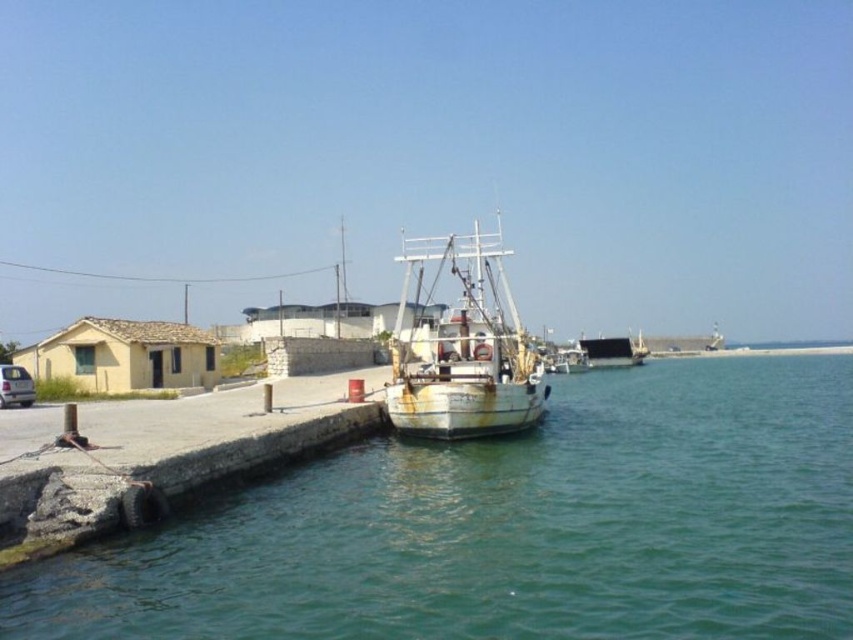
From the picture: You are a photographer wanting to capture the rusty metal boat at center and the green water at center in a single frame. Given that your camera has a fixed focal length, which object should you position closer to the center of the frame to ensure both fit within the shot?

Since the green water at center is wider than the rusty metal boat at center, you should position the green water at center closer to the center of the frame to ensure both fit within the shot.

You are standing on the rusty concrete dock at lower left and want to reach the rusty metal boat at center. Which direction should you move to get there?

The rusty concrete dock at lower left is located below the rusty metal boat at center, so you should move upward to reach the rusty metal boat at center.

You are standing on the pier and looking at the green water at center and the rusty metal boat at center. Which object is located lower in the scene?

The green water at center is located lower than the rusty metal boat at center because it is positioned below it.